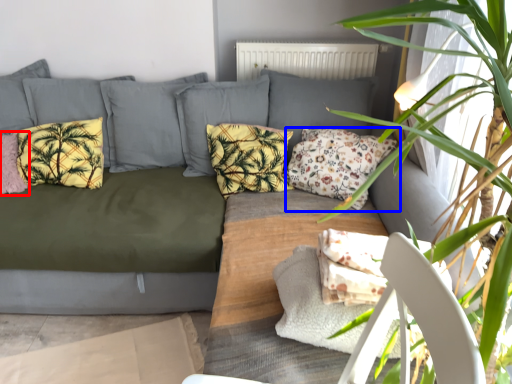
Question: Which object is further to the camera taking this photo, pillow (highlighted by a red box) or pillow (highlighted by a blue box)?

Choices:
 (A) pillow
 (B) pillow

Answer: (A)